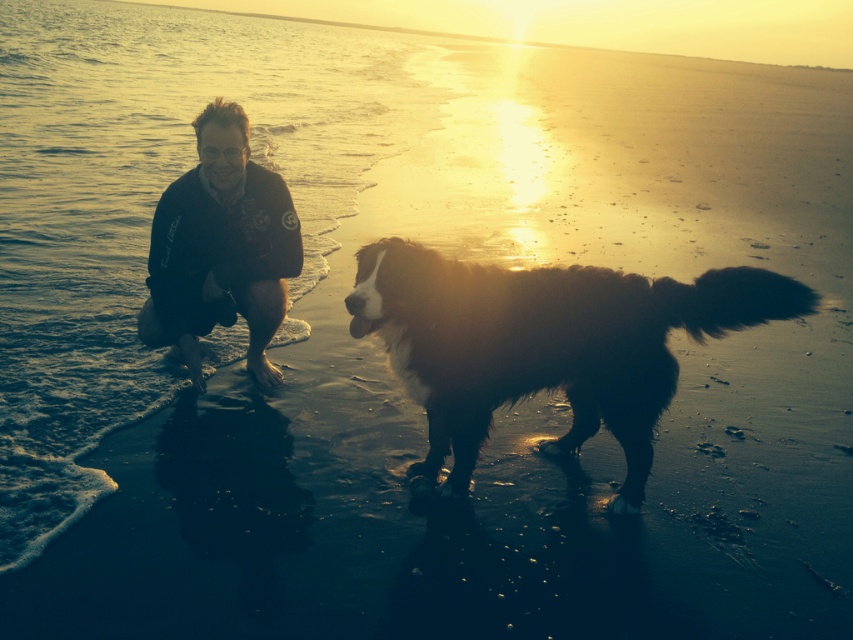
Is black shaggy dog at center to the right of black softshell jacket at left from the viewer's perspective?

Yes, black shaggy dog at center is to the right of black softshell jacket at left.

Where is `black shaggy dog at center`? This screenshot has height=640, width=853. black shaggy dog at center is located at coordinates (546, 344).